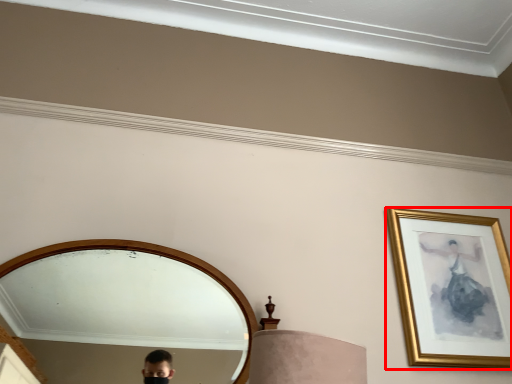
Question: From the image's perspective, where is picture frame (annotated by the red box) located in relation to mirror in the image?

Choices:
 (A) below
 (B) above

Answer: (B)